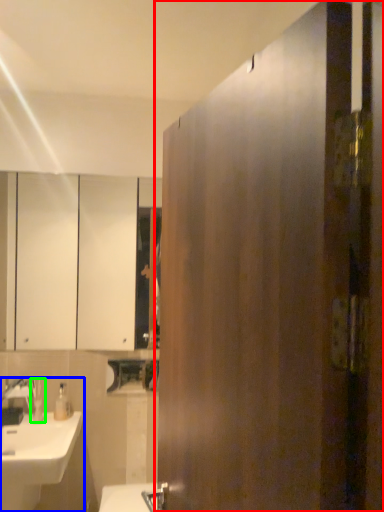
Question: Considering the real-world distances, which object is closest to door (highlighted by a red box)? sink (highlighted by a blue box) or toiletry (highlighted by a green box).

Choices:
 (A) sink
 (B) toiletry

Answer: (A)